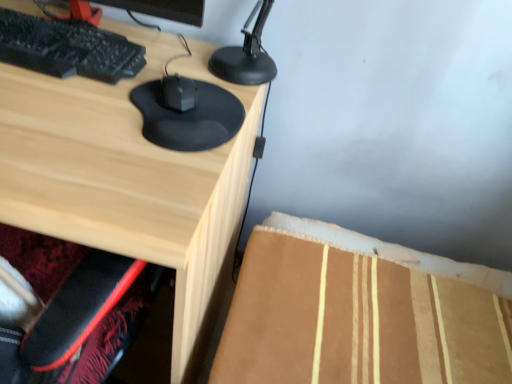
Identify the location of free space in front of black matte mouse at center. The height and width of the screenshot is (384, 512). (125, 178).